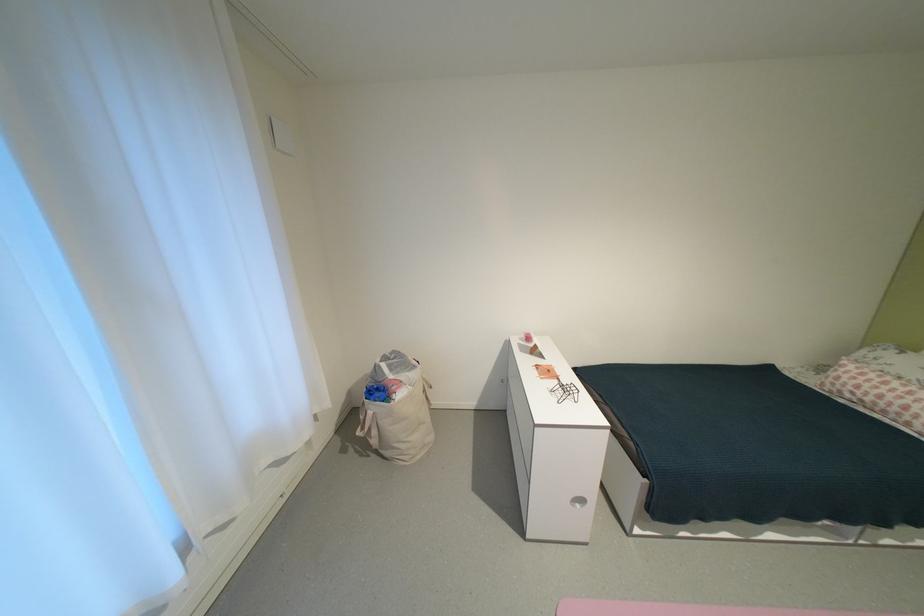
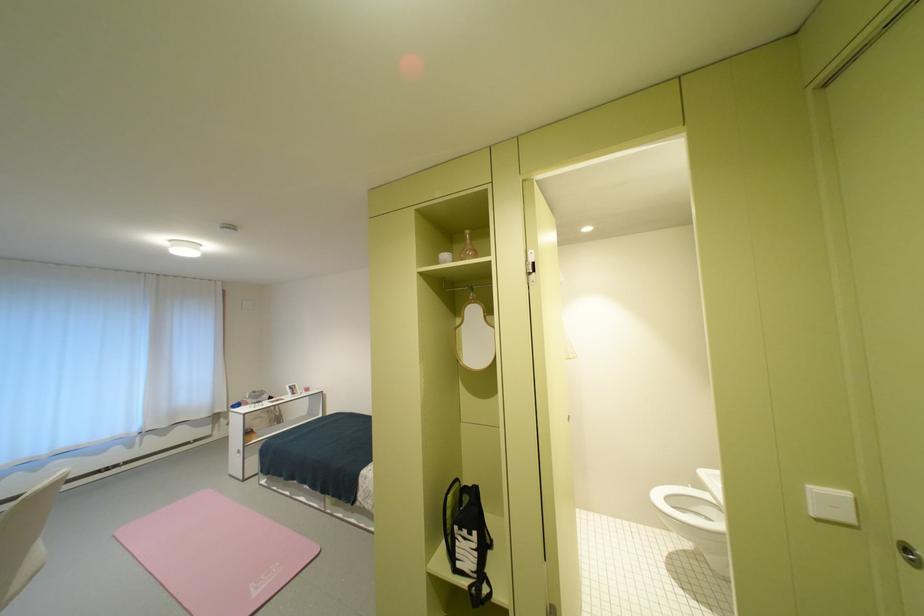
Question: I am providing you with two images of the same scene from different viewpoints. After the viewpoint changes to image2, which objects are now occluded?

Choices:
 (A) small brown bottle
 (B) pink yoga mat
 (C) toilet seat
 (D) laundry bag handle

Answer: (D)